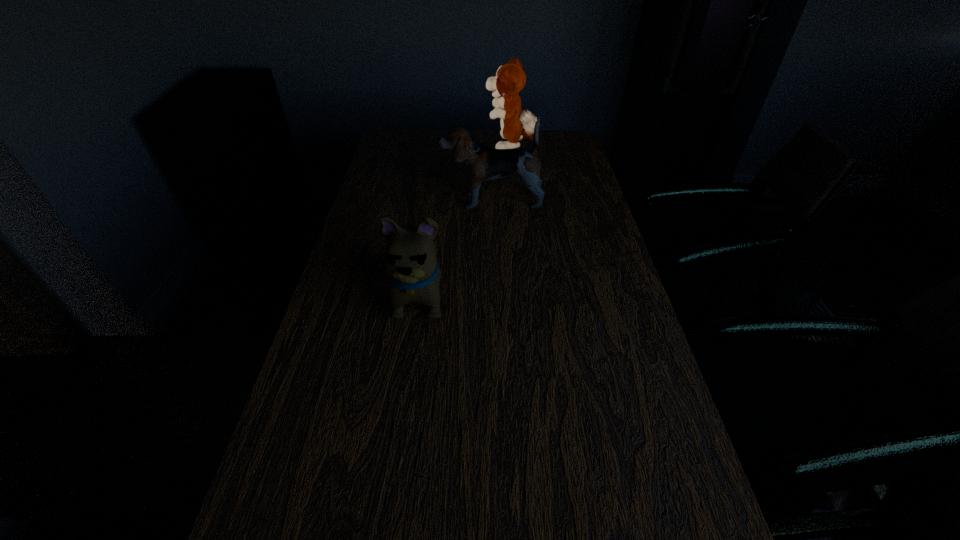
Image resolution: width=960 pixels, height=540 pixels. I want to click on object that stands as the closest to the farthest object, so click(x=482, y=163).

You are a GUI agent. You are given a task and a screenshot of the screen. Output one action in this format:
    pyautogui.click(x=<x>, y=<y>)
    Task: Click on the object that stands as the second closest to the second nearest object
    Image resolution: width=960 pixels, height=540 pixels.
    Given the screenshot: What is the action you would take?
    pyautogui.click(x=410, y=263)

Where is `the second closest puppy to the second nearest object`? This screenshot has height=540, width=960. the second closest puppy to the second nearest object is located at coordinates (410, 263).

Locate an element on the screen. The width and height of the screenshot is (960, 540). puppy that stands as the second closest to the nearest object is located at coordinates 510,79.

Identify the location of vacant area that satisfies the following two spatial constraints: 1. on the face of the farthest puppy; 2. on the face of the nearest object. (526, 295).

The width and height of the screenshot is (960, 540). What are the coordinates of `vacant area that satisfies the following two spatial constraints: 1. at the face of the second nearest puppy; 2. on the face of the nearest puppy` in the screenshot? It's located at (494, 295).

Locate an element on the screen. Image resolution: width=960 pixels, height=540 pixels. vacant space that satisfies the following two spatial constraints: 1. on the face of the farthest object; 2. on the face of the nearest puppy is located at coordinates (526, 295).

Identify the location of blank space that satisfies the following two spatial constraints: 1. on the face of the farthest object; 2. on the face of the nearest puppy. (526, 295).